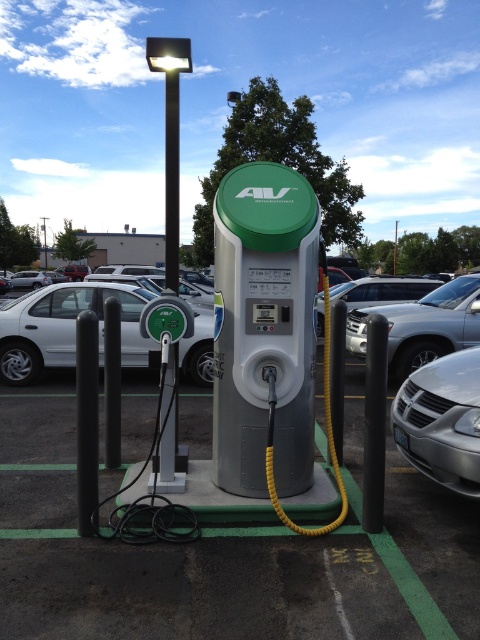
Between black metal pole at upper center and metallic pole at upper center, which one has less height?

With less height is metallic pole at upper center.

Is point (175, 256) in front of point (44, 243)?

That is True.

I want to click on black metal pole at upper center, so click(170, 140).

In order to click on metallic gray charging station at center in this screenshot , I will do `click(225, 552)`.

This screenshot has width=480, height=640. What are the coordinates of `metallic gray charging station at center` in the screenshot? It's located at (225, 552).

Between point (400, 380) and point (45, 250), which one is positioned in front?

Point (400, 380) is more forward.

Is silver metallic suv at center right below metallic pole at upper center?

Indeed, silver metallic suv at center right is positioned under metallic pole at upper center.

Find the location of a particular element. The width and height of the screenshot is (480, 640). silver metallic suv at center right is located at coordinates (422, 324).